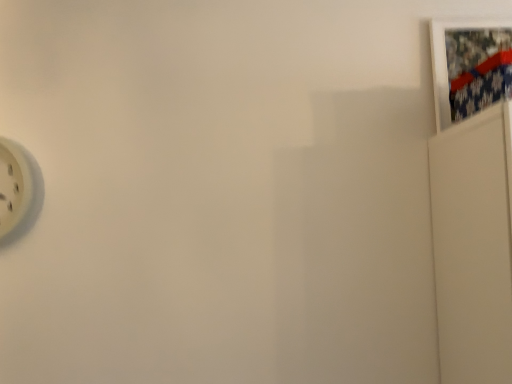
Question: From the image's perspective, is white plastic wall clock at left located above or below white matte picture frame at upper right?

Choices:
 (A) above
 (B) below

Answer: (B)

Question: Relative to white matte picture frame at upper right, is white plastic wall clock at left in front or behind?

Choices:
 (A) front
 (B) behind

Answer: (A)

Question: Is white plastic wall clock at left wider or thinner than white matte picture frame at upper right?

Choices:
 (A) wide
 (B) thin

Answer: (A)

Question: In terms of size, does white matte picture frame at upper right appear bigger or smaller than white plastic wall clock at left?

Choices:
 (A) small
 (B) big

Answer: (A)

Question: In terms of height, does white matte picture frame at upper right look taller or shorter compared to white plastic wall clock at left?

Choices:
 (A) tall
 (B) short

Answer: (A)

Question: Is white matte picture frame at upper right wider or thinner than white plastic wall clock at left?

Choices:
 (A) wide
 (B) thin

Answer: (B)

Question: Would you say white matte picture frame at upper right is inside or outside white plastic wall clock at left?

Choices:
 (A) outside
 (B) inside

Answer: (A)